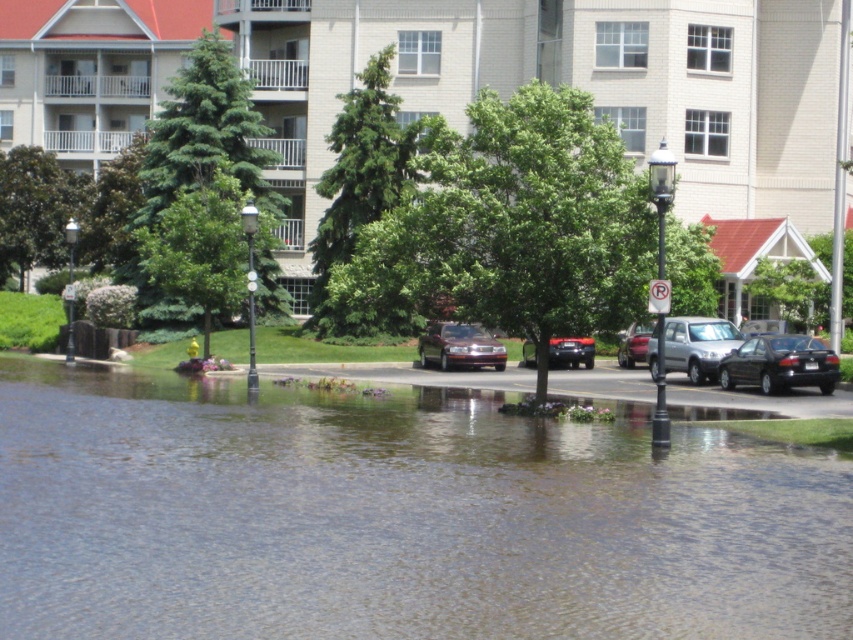
Question: Which object is farther from the camera taking this photo?

Choices:
 (A) shiny black sedan at center
 (B) satin silver suv at center
 (C) black matte sedan at lower right
 (D) shiny maroon sedan at center

Answer: (D)

Question: Is clear water at lower center further to the viewer compared to shiny silver sedan at center?

Choices:
 (A) yes
 (B) no

Answer: (B)

Question: Does satin silver suv at center appear on the left side of shiny silver sedan at center?

Choices:
 (A) no
 (B) yes

Answer: (A)

Question: Can you confirm if satin silver suv at center is positioned below shiny black sedan at center?

Choices:
 (A) no
 (B) yes

Answer: (A)

Question: Which point appears closest to the camera in this image?

Choices:
 (A) [x=770, y=390]
 (B) [x=577, y=358]

Answer: (A)

Question: Which of the following is the closest to the observer?

Choices:
 (A) clear water at lower center
 (B) shiny silver sedan at center

Answer: (A)